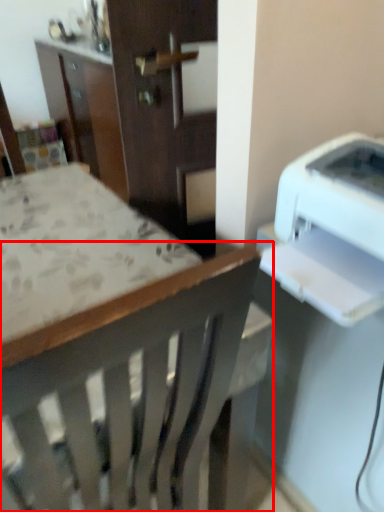
Question: In this image, where is chair (annotated by the red box) located relative to printer?

Choices:
 (A) left
 (B) right

Answer: (A)